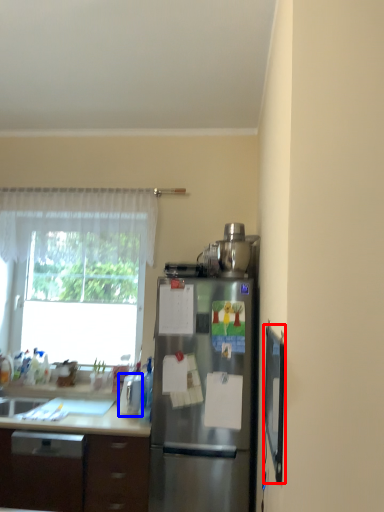
Question: Which of the following is the farthest to the observer, screen door (highlighted by a red box) or appliance (highlighted by a blue box)?

Choices:
 (A) screen door
 (B) appliance

Answer: (B)